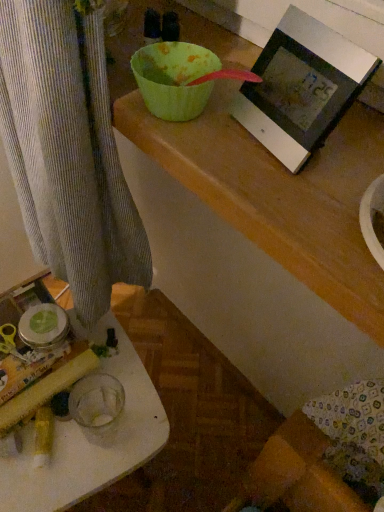
Question: Can you confirm if matte black picture frame at upper right is positioned to the left of white plastic table at lower left?

Choices:
 (A) no
 (B) yes

Answer: (A)

Question: Is matte black picture frame at upper right taller than white plastic table at lower left?

Choices:
 (A) no
 (B) yes

Answer: (A)

Question: Is matte black picture frame at upper right at the right side of white plastic table at lower left?

Choices:
 (A) yes
 (B) no

Answer: (A)

Question: Is matte black picture frame at upper right further to the viewer compared to white plastic table at lower left?

Choices:
 (A) yes
 (B) no

Answer: (B)

Question: Is the position of matte black picture frame at upper right less distant than that of white plastic table at lower left?

Choices:
 (A) no
 (B) yes

Answer: (B)

Question: Can you confirm if matte black picture frame at upper right is shorter than white plastic table at lower left?

Choices:
 (A) no
 (B) yes

Answer: (B)

Question: Is white plastic table at lower left to the right of matte black picture frame at upper right from the viewer's perspective?

Choices:
 (A) no
 (B) yes

Answer: (A)

Question: Is white plastic table at lower left not close to matte black picture frame at upper right?

Choices:
 (A) no
 (B) yes

Answer: (A)

Question: Does white plastic table at lower left lie behind matte black picture frame at upper right?

Choices:
 (A) no
 (B) yes

Answer: (B)

Question: Is white plastic table at lower left not within matte black picture frame at upper right?

Choices:
 (A) no
 (B) yes

Answer: (B)

Question: Is the surface of white plastic table at lower left in direct contact with matte black picture frame at upper right?

Choices:
 (A) yes
 (B) no

Answer: (B)

Question: Considering the relative sizes of white plastic table at lower left and matte black picture frame at upper right in the image provided, is white plastic table at lower left wider than matte black picture frame at upper right?

Choices:
 (A) no
 (B) yes

Answer: (B)

Question: From the image's perspective, is white plastic table at lower left positioned above or below matte black picture frame at upper right?

Choices:
 (A) below
 (B) above

Answer: (A)